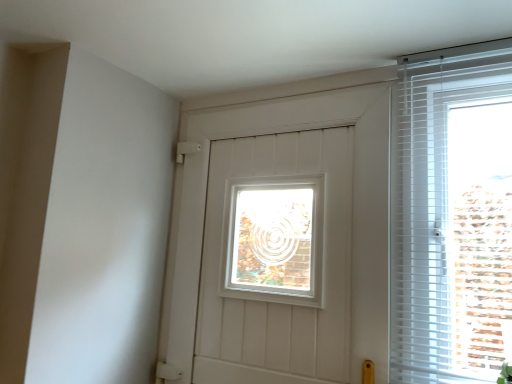
Question: From a real-world perspective, is white plastic blinds at right physically above white matte door at center?

Choices:
 (A) yes
 (B) no

Answer: (A)

Question: Can you confirm if white plastic blinds at right is bigger than white matte door at center?

Choices:
 (A) no
 (B) yes

Answer: (A)

Question: From the image's perspective, is white plastic blinds at right on top of white matte door at center?

Choices:
 (A) yes
 (B) no

Answer: (A)

Question: Could you tell me if white plastic blinds at right is facing white matte door at center?

Choices:
 (A) no
 (B) yes

Answer: (A)

Question: Is white plastic blinds at right taller than white matte door at center?

Choices:
 (A) no
 (B) yes

Answer: (A)

Question: Considering the relative positions of white plastic blinds at right and white matte door at center in the image provided, is white plastic blinds at right to the left of white matte door at center from the viewer's perspective?

Choices:
 (A) no
 (B) yes

Answer: (A)

Question: From the image's perspective, is white matte door at center over white plastic blinds at right?

Choices:
 (A) yes
 (B) no

Answer: (B)

Question: Does white matte door at center have a smaller size compared to white plastic blinds at right?

Choices:
 (A) yes
 (B) no

Answer: (B)

Question: Is white matte door at center positioned beyond the bounds of white plastic blinds at right?

Choices:
 (A) no
 (B) yes

Answer: (B)

Question: Does white matte door at center touch white plastic blinds at right?

Choices:
 (A) no
 (B) yes

Answer: (A)

Question: From a real-world perspective, is white matte door at center on white plastic blinds at right?

Choices:
 (A) no
 (B) yes

Answer: (A)

Question: Is white matte door at center at the left side of white plastic blinds at right?

Choices:
 (A) no
 (B) yes

Answer: (B)

Question: Which is correct: white plastic blinds at right is inside white matte door at center, or outside of it?

Choices:
 (A) outside
 (B) inside

Answer: (A)